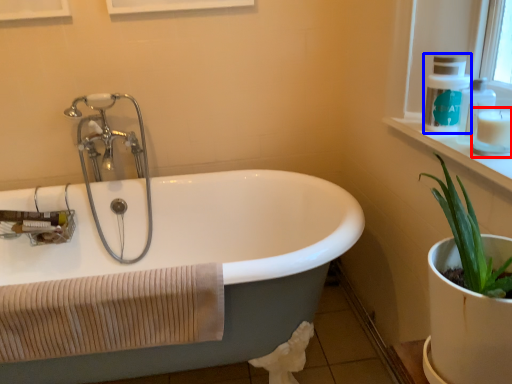
Question: Which object appears closest to the camera in this image, toiletry (highlighted by a red box) or soap dispenser (highlighted by a blue box)?

Choices:
 (A) toiletry
 (B) soap dispenser

Answer: (A)